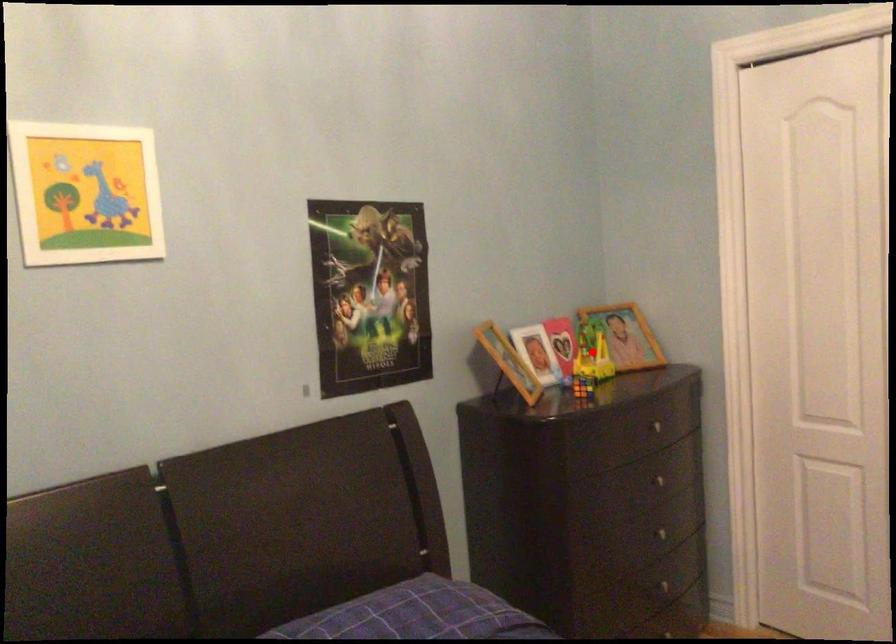
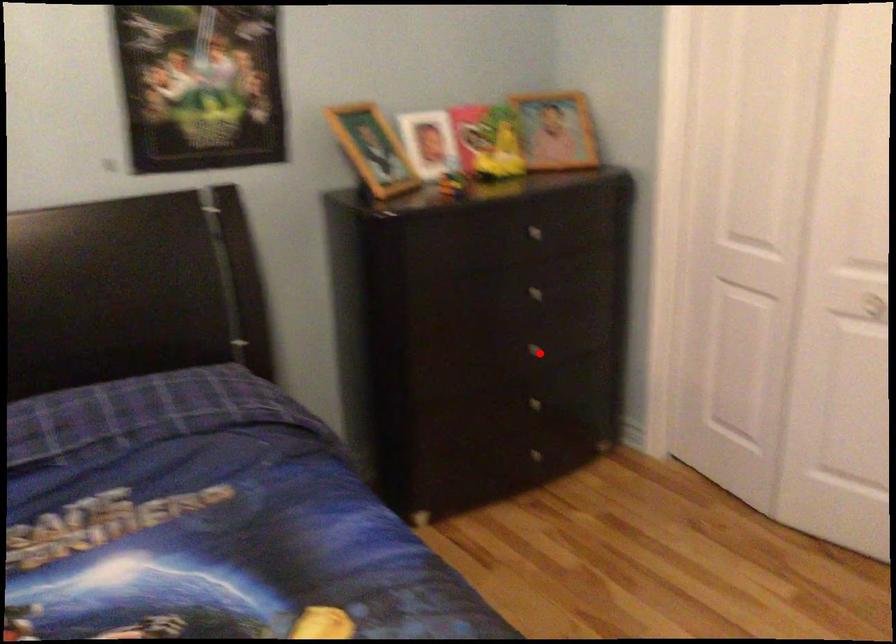
I am providing you with two images of the same scene from different viewpoints. A red point is marked on the first image and another point is marked on the second image. Are the points marked in image1 and image2 representing the same 3D position?

No